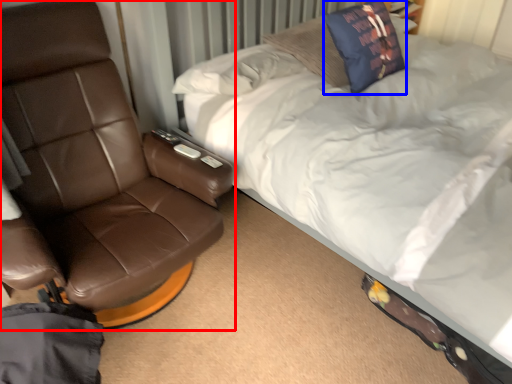
Question: Which point is further to the camera, chair (highlighted by a red box) or throw pillow (highlighted by a blue box)?

Choices:
 (A) chair
 (B) throw pillow

Answer: (B)